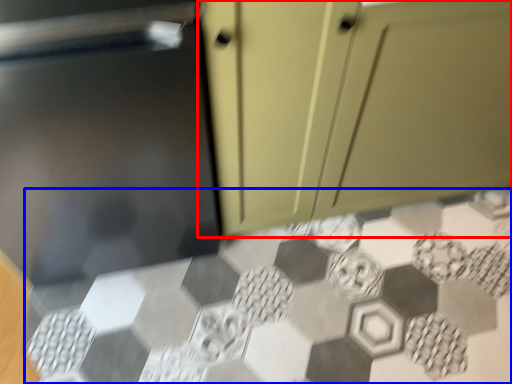
Question: Which of the following is the farthest to the observer, cabinetry (highlighted by a red box) or ceramic tile (highlighted by a blue box)?

Choices:
 (A) cabinetry
 (B) ceramic tile

Answer: (B)